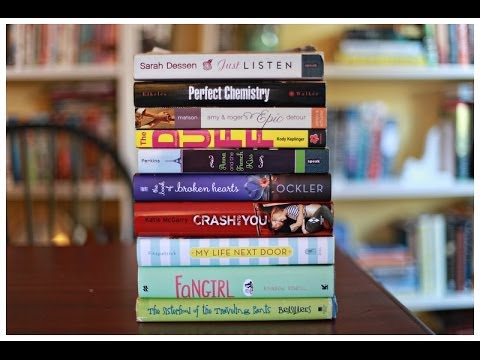
Identify the location of books. The width and height of the screenshot is (480, 360). (278, 71), (276, 88), (267, 112), (253, 135), (243, 157), (232, 187), (228, 224), (228, 254), (229, 285), (230, 314).